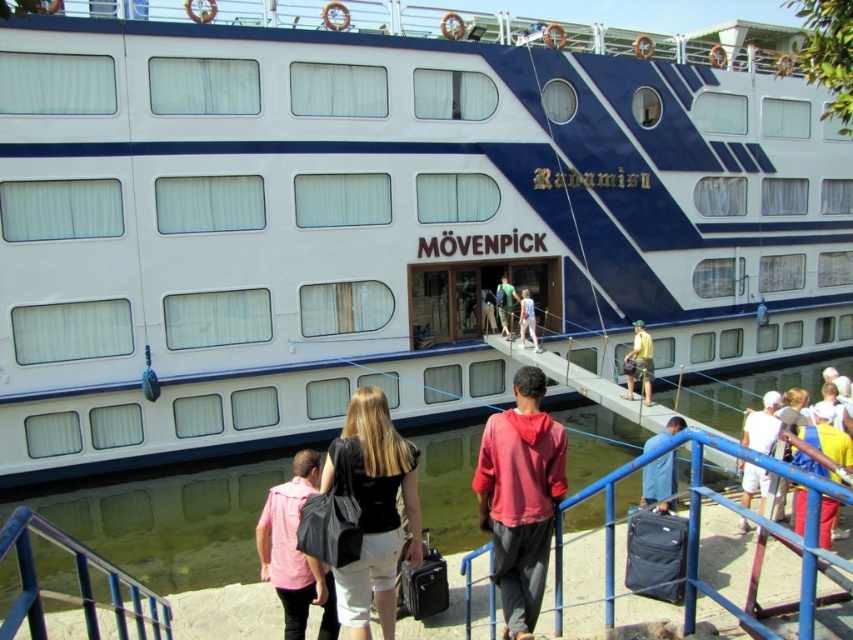
Is red matte hoodie at center thinner than yellow fabric shirt at lower right?

Yes, red matte hoodie at center is thinner than yellow fabric shirt at lower right.

Is point (486, 509) in front of point (822, 408)?

Yes, it is.

The width and height of the screenshot is (853, 640). I want to click on red matte hoodie at center, so click(x=520, y=497).

Is black fabric bag at center shorter than light blue denim jeans at center?

No, black fabric bag at center is not shorter than light blue denim jeans at center.

The image size is (853, 640). Describe the element at coordinates (374, 509) in the screenshot. I see `black fabric bag at center` at that location.

Is point (379, 474) in front of point (531, 326)?

That is True.

The width and height of the screenshot is (853, 640). In order to click on black fabric bag at center in this screenshot , I will do `click(374, 509)`.

Looking at this image, is black fabric bag at center shorter than pink fabric shirt at center?

Incorrect, black fabric bag at center's height does not fall short of pink fabric shirt at center's.

Is point (357, 433) less distant than point (294, 474)?

Yes, point (357, 433) is in front of point (294, 474).

The image size is (853, 640). Find the location of `black fabric bag at center`. black fabric bag at center is located at coordinates point(374,509).